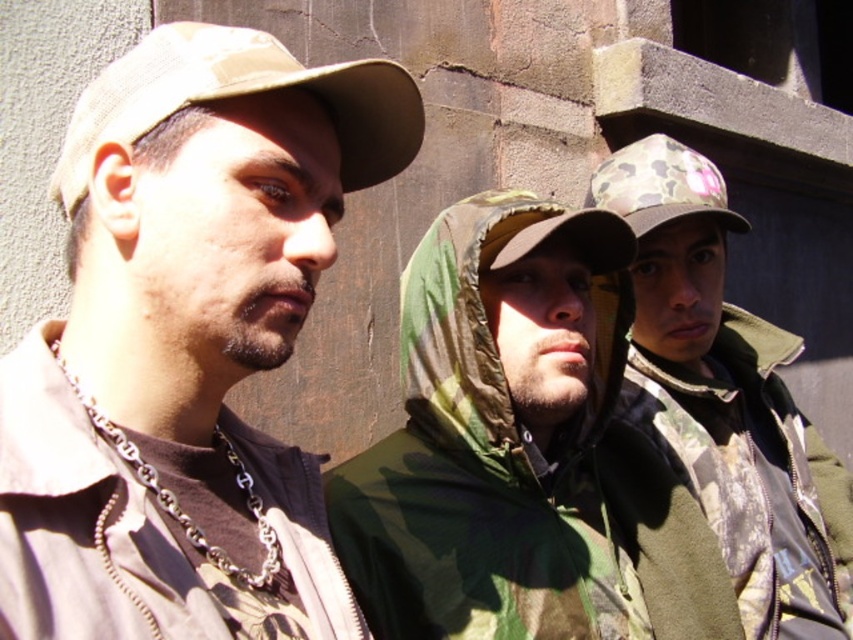
You are a photographer trying to capture a candid shot of the person wearing the camouflage jacket at center. You notice a point marked at coordinates (498, 435). Where is this point located in relation to the camouflage fabric jacket at center?

The point marked at coordinates (498, 435) is located on the camouflage fabric jacket at center.